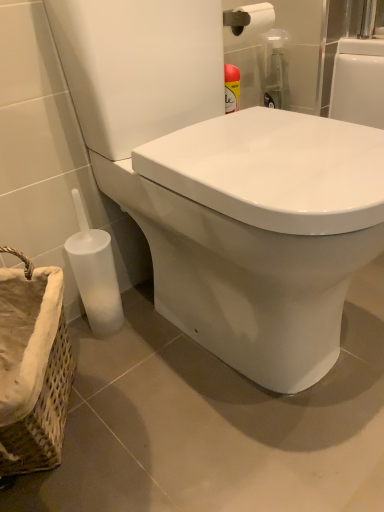
Locate an element on the screen. The height and width of the screenshot is (512, 384). unoccupied region to the right of woven fabric basket at lower left is located at coordinates (154, 411).